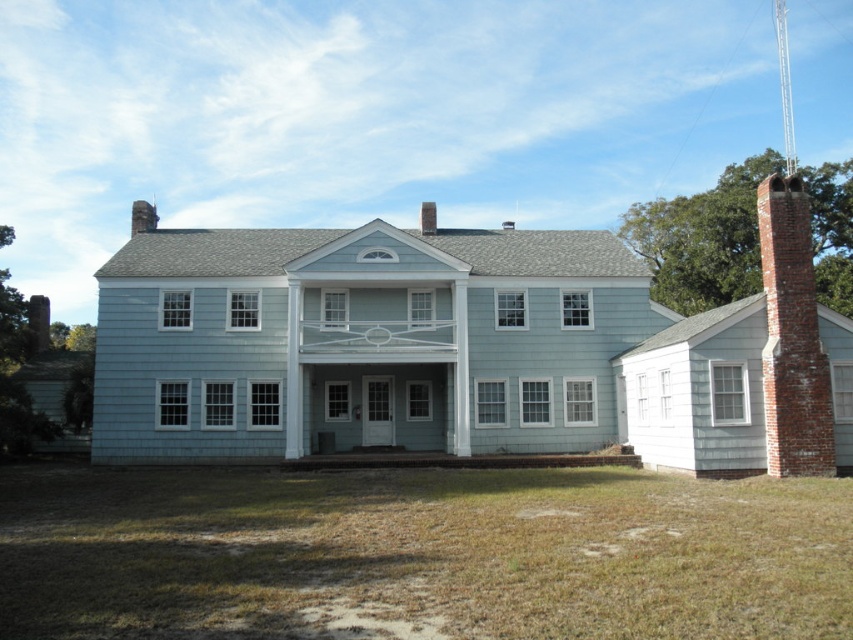
Does brick chimney at right appear on the right side of brick chimney at center?

Yes, brick chimney at right is to the right of brick chimney at center.

Who is positioned more to the left, brick chimney at right or brick chimney at center?

Positioned to the left is brick chimney at center.

What do you see at coordinates (792, 337) in the screenshot?
I see `brick chimney at right` at bounding box center [792, 337].

At what (x,y) coordinates should I click in order to perform the action: click on brick chimney at right. Please return your answer as a coordinate pair (x, y). The width and height of the screenshot is (853, 640). Looking at the image, I should click on (792, 337).

Is point (45, 336) positioned behind point (138, 230)?

Yes, it is behind point (138, 230).

How much distance is there between brick chimney at left and brick chimney at upper center?

39.31 feet

Between point (38, 304) and point (141, 225), which one is positioned behind?

Point (38, 304)

You are a GUI agent. You are given a task and a screenshot of the screen. Output one action in this format:
    pyautogui.click(x=<x>, y=<y>)
    Task: Click on the brick chimney at left
    This screenshot has height=640, width=853.
    Given the screenshot: What is the action you would take?
    pyautogui.click(x=38, y=323)

Which is more to the right, brick chimney at left or brick chimney at center?

brick chimney at center is more to the right.

From the picture: Which of these two, brick chimney at left or brick chimney at center, stands taller?

brick chimney at center

The width and height of the screenshot is (853, 640). What are the coordinates of `brick chimney at left` in the screenshot? It's located at [x=38, y=323].